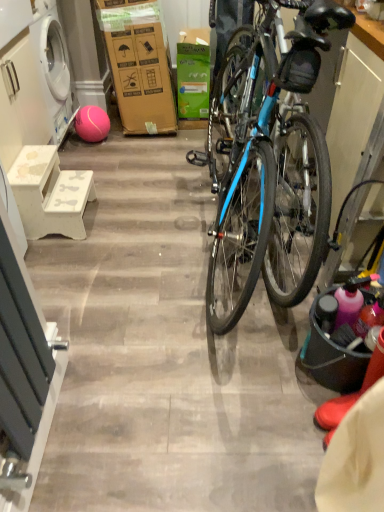
Question: From a real-world perspective, is pink rubber ball at lower left above or below white wood cabinet at left?

Choices:
 (A) above
 (B) below

Answer: (B)

Question: Considering the positions of point (89, 138) and point (4, 71), is point (89, 138) closer or farther from the camera than point (4, 71)?

Choices:
 (A) closer
 (B) farther

Answer: (B)

Question: Estimate the real-world distances between objects in this image. Which object is closer to the white matte stool at left?

Choices:
 (A) pink rubber ball at lower left
 (B) white wood cabinet at left
 (C) green cardboard box at center
 (D) matte black bucket at right

Answer: (B)

Question: Which object is positioned farthest from the matte black bucket at right?

Choices:
 (A) white wood cabinet at left
 (B) green cardboard box at center
 (C) white matte stool at left
 (D) pink rubber ball at lower left

Answer: (D)